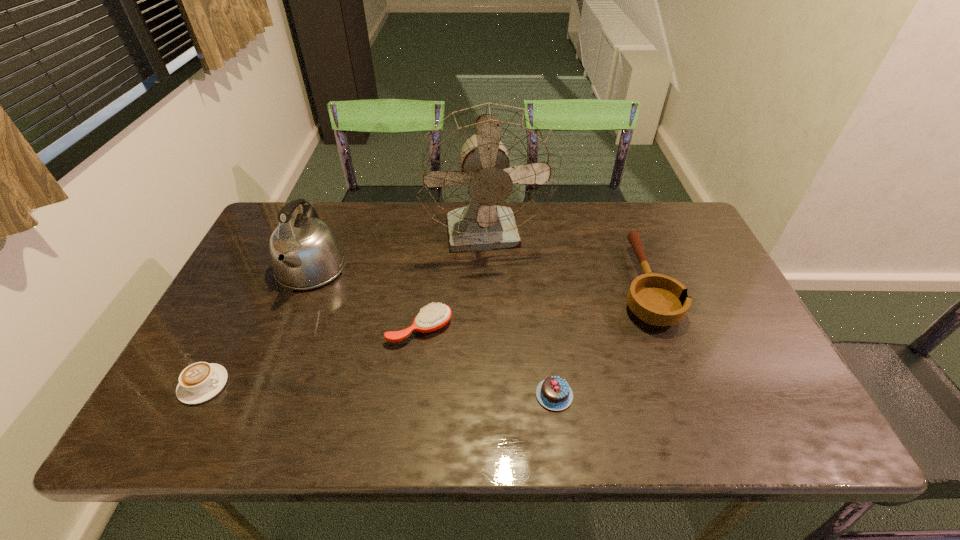
Find the location of a particular element. Image resolution: width=960 pixels, height=540 pixels. vacant point located between the fan and the cappuccino is located at coordinates (345, 311).

Where is `free space between the tallest object and the cappuccino`? free space between the tallest object and the cappuccino is located at coordinates (345, 311).

Where is `object that is the fourth closest to the cappuccino`? Image resolution: width=960 pixels, height=540 pixels. object that is the fourth closest to the cappuccino is located at coordinates (554, 393).

Where is `object that stands as the closest to the cappuccino`? The width and height of the screenshot is (960, 540). object that stands as the closest to the cappuccino is located at coordinates (305, 253).

The height and width of the screenshot is (540, 960). I want to click on free location that satisfies the following two spatial constraints: 1. on the spout of the chocolate cake; 2. on the right side of the fifth shortest object, so click(260, 395).

Identify the location of vacant position in the image that satisfies the following two spatial constraints: 1. on the spout of the fifth shortest object; 2. with the handle on the right side of the cappuccino. (264, 384).

At what (x,y) coordinates should I click in order to perform the action: click on vacant space that satisfies the following two spatial constraints: 1. on the spout of the kettle; 2. on the left side of the hairbrush. Please return your answer as a coordinate pair (x, y). Image resolution: width=960 pixels, height=540 pixels. Looking at the image, I should click on (287, 329).

Identify the location of free spot that satisfies the following two spatial constraints: 1. in front of the tallest object to blow air; 2. with the handle on the right side of the cappuccino. The width and height of the screenshot is (960, 540). (489, 384).

Image resolution: width=960 pixels, height=540 pixels. I want to click on vacant space that satisfies the following two spatial constraints: 1. on the spout of the second tallest object; 2. on the left side of the hairbrush, so click(287, 329).